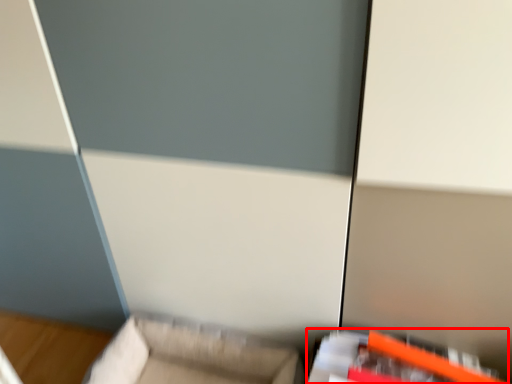
Question: In this image, where is furniture (annotated by the red box) located relative to furniture?

Choices:
 (A) right
 (B) left

Answer: (A)